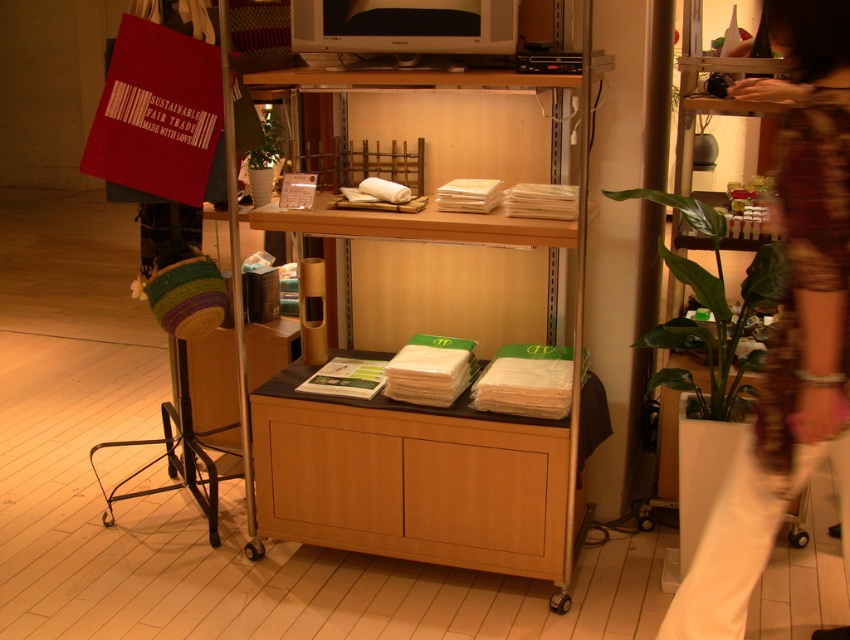
Question: From the image, what is the correct spatial relationship of green leafy plant at right in relation to green leafy plant at center?

Choices:
 (A) above
 (B) below

Answer: (B)

Question: Which point appears farthest from the camera in this image?

Choices:
 (A) (282, 148)
 (B) (584, 224)

Answer: (A)

Question: Does wooden bookshelf at center appear over green leafy plant at right?

Choices:
 (A) yes
 (B) no

Answer: (B)

Question: Based on their relative distances, which object is nearer to the wooden bookshelf at center?

Choices:
 (A) green leafy plant at right
 (B) wooden cabinet at center
 (C) green leafy plant at center
 (D) wooden bracelet at lower right

Answer: (B)

Question: In this image, where is wooden bookshelf at center located relative to green leafy plant at right?

Choices:
 (A) right
 (B) left

Answer: (B)

Question: Which of the following is the closest to the observer?

Choices:
 (A) green leafy plant at right
 (B) wooden cabinet at center

Answer: (A)